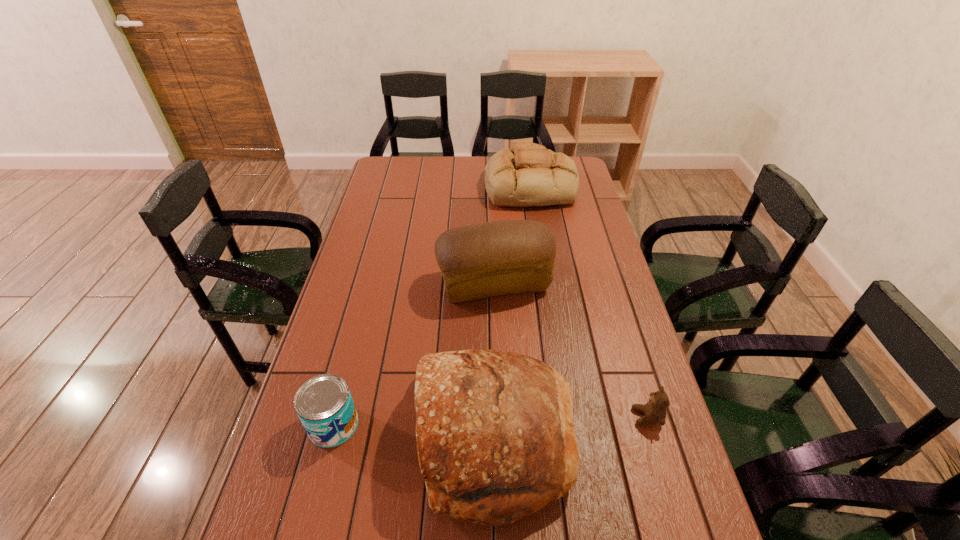
This screenshot has width=960, height=540. What are the coordinates of `the fourth nearest object` in the screenshot? It's located at (500, 257).

Find the location of `the nearest bread`. the nearest bread is located at coordinates (495, 438).

Image resolution: width=960 pixels, height=540 pixels. I want to click on the shortest bread, so click(528, 175).

Find the location of a particular element. the third shortest object is located at coordinates (528, 175).

Where is `can`? The width and height of the screenshot is (960, 540). can is located at coordinates (324, 405).

Where is `the leftmost object`? This screenshot has width=960, height=540. the leftmost object is located at coordinates (324, 405).

I want to click on the shortest object, so click(654, 411).

At what (x,y) coordinates should I click in order to perform the action: click on free space located on the left of the second nearest bread. Please return your answer as a coordinate pair (x, y). Image resolution: width=960 pixels, height=540 pixels. Looking at the image, I should click on (368, 282).

In order to click on vacant area located 0.120m at the sliced front of the nearest bread in this screenshot , I will do `click(370, 437)`.

Where is `vacant space located 0.130m at the sliced front of the nearest bread`? vacant space located 0.130m at the sliced front of the nearest bread is located at coordinates (366, 437).